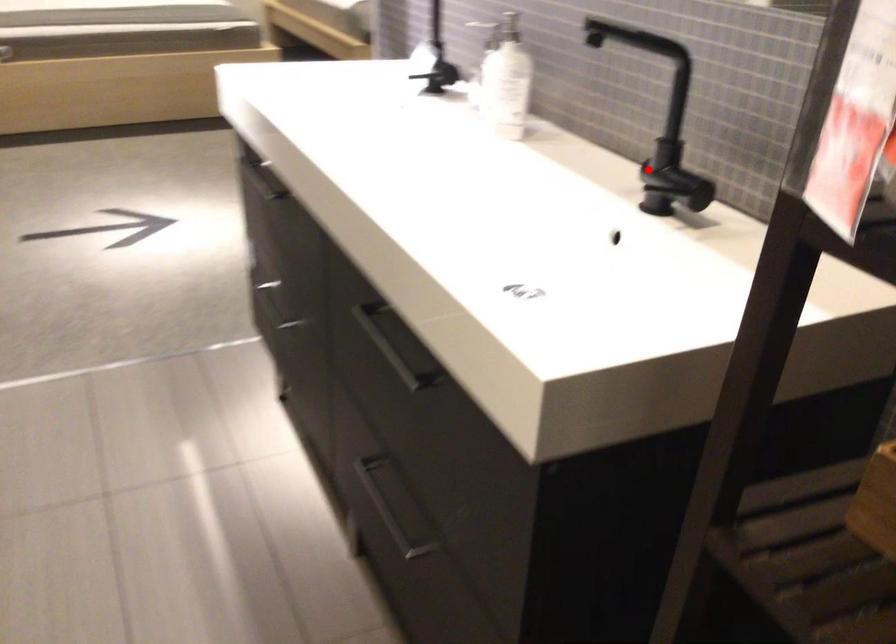
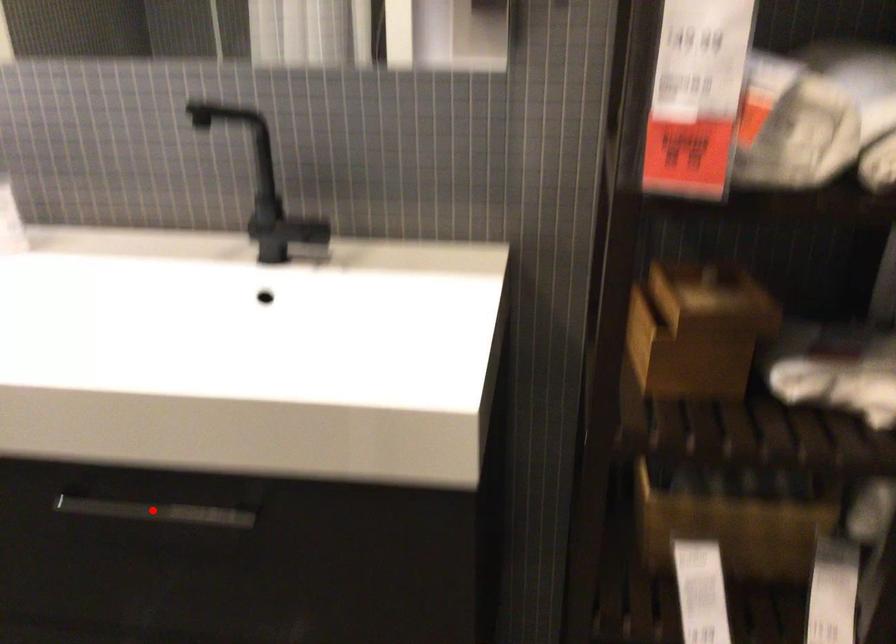
I am providing you with two images of the same scene from different viewpoints. A red point is marked on the first image and another point is marked on the second image. Does the point marked in image1 correspond to the same location as the one in image2?

No